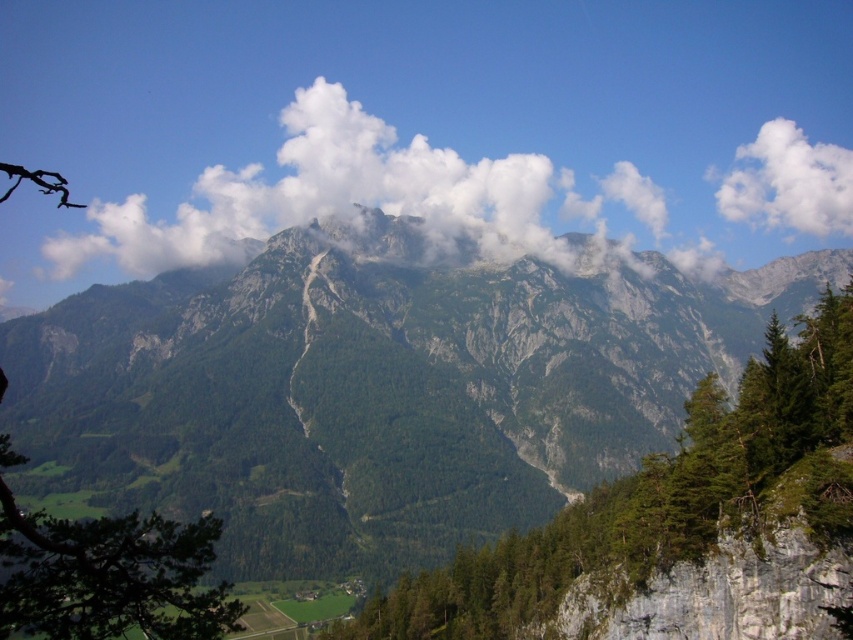
Measure the distance between green rough rock at center and white fluffy cloud at upper right.

green rough rock at center is 313.91 meters away from white fluffy cloud at upper right.

Can you confirm if green rough rock at center is bigger than white fluffy cloud at upper right?

Correct, green rough rock at center is larger in size than white fluffy cloud at upper right.

Is point (782, 369) positioned behind point (840, 152)?

No, it is not.

Where is `green rough rock at center`? green rough rock at center is located at coordinates (660, 499).

Can you confirm if green rough rock at center is thinner than white fluffy cloud at upper center?

Correct, green rough rock at center's width is less than white fluffy cloud at upper center's.

Does point (640, 557) come in front of point (361, 164)?

That is True.

Find the location of a particular element. green rough rock at center is located at coordinates (660, 499).

Describe the element at coordinates (352, 193) in the screenshot. I see `white fluffy cloud at upper center` at that location.

Is white fluffy cloud at upper center behind white fluffy cloud at upper right?

No, white fluffy cloud at upper center is closer to the viewer.

Find the location of a particular element. The width and height of the screenshot is (853, 640). white fluffy cloud at upper center is located at coordinates (352, 193).